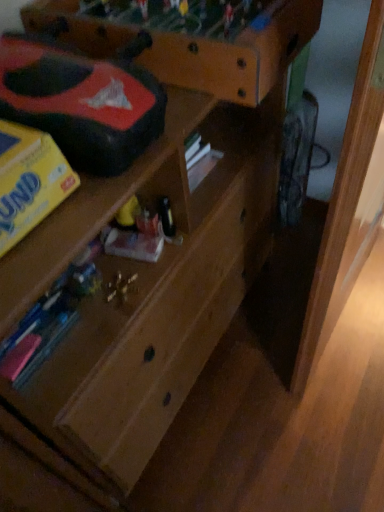
Question: Considering their positions, is wooden shelf at upper center located in front of or behind rubberized black toy car at upper left?

Choices:
 (A) front
 (B) behind

Answer: (B)

Question: From the image's perspective, relative to rubberized black toy car at upper left, is wooden shelf at upper center above or below?

Choices:
 (A) above
 (B) below

Answer: (A)

Question: From a real-world perspective, is wooden shelf at upper center above or below rubberized black toy car at upper left?

Choices:
 (A) below
 (B) above

Answer: (A)

Question: Would you say rubberized black toy car at upper left is to the left or to the right of wooden shelf at upper center in the picture?

Choices:
 (A) left
 (B) right

Answer: (A)

Question: Is point (69, 59) positioned closer to the camera than point (99, 31)?

Choices:
 (A) farther
 (B) closer

Answer: (B)

Question: Is rubberized black toy car at upper left inside or outside of wooden shelf at upper center?

Choices:
 (A) outside
 (B) inside

Answer: (A)

Question: From a real-world perspective, relative to wooden shelf at upper center, is rubberized black toy car at upper left vertically above or below?

Choices:
 (A) below
 (B) above

Answer: (B)